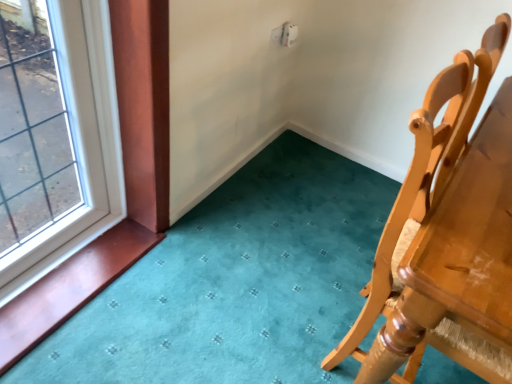
The height and width of the screenshot is (384, 512). What do you see at coordinates (447, 234) in the screenshot? I see `light brown polished wood chair at right` at bounding box center [447, 234].

You are a GUI agent. You are given a task and a screenshot of the screen. Output one action in this format:
    pyautogui.click(x=<x>, y=<y>)
    Task: Click on the light brown polished wood chair at right
    The height and width of the screenshot is (384, 512).
    Given the screenshot: What is the action you would take?
    pyautogui.click(x=447, y=234)

Identify the location of light brown polished wood chair at right. (447, 234).